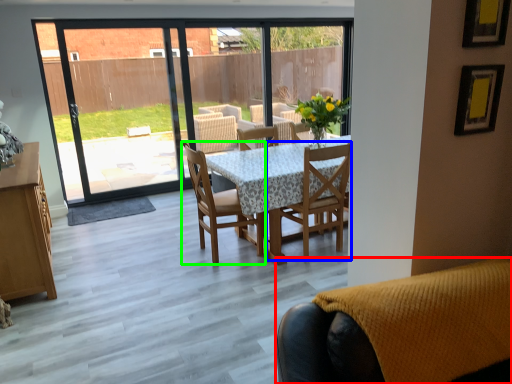
Question: Which object is positioned closest to chair (highlighted by a red box)? Select from chair (highlighted by a blue box) and chair (highlighted by a green box).

Choices:
 (A) chair
 (B) chair

Answer: (A)